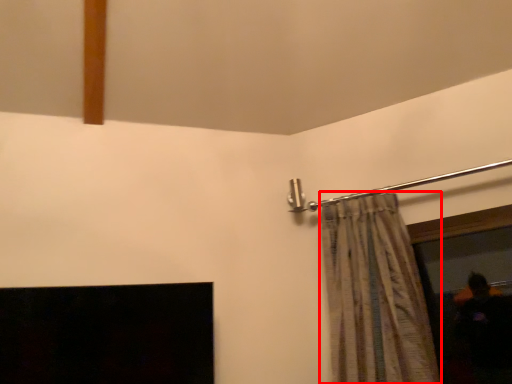
Question: From the image's perspective, what is the correct spatial relationship of curtain (annotated by the red box) in relation to window screen?

Choices:
 (A) below
 (B) above

Answer: (B)